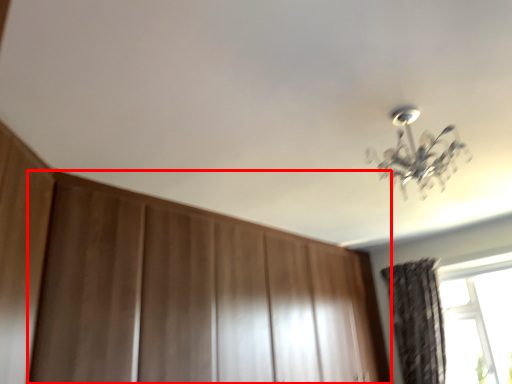
Question: From the image's perspective, what is the correct spatial relationship of dresser (annotated by the red box) in relation to curtain?

Choices:
 (A) above
 (B) below

Answer: (A)